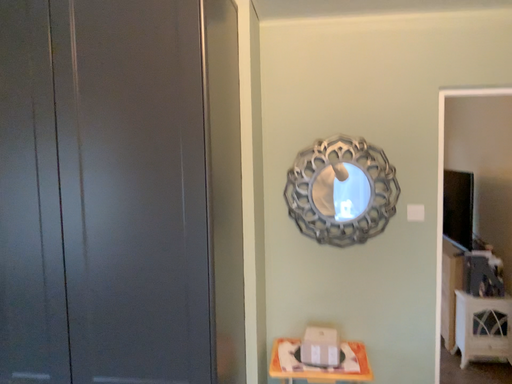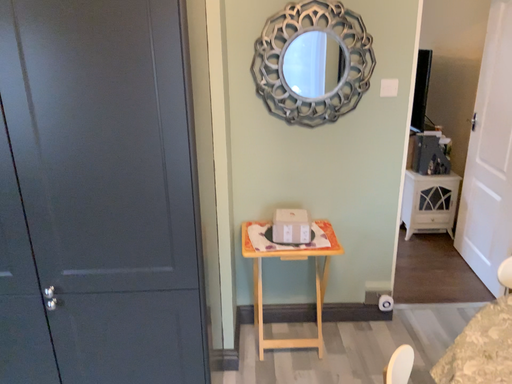
Question: Which way did the camera rotate in the video?

Choices:
 (A) rotated downward
 (B) rotated upward

Answer: (A)